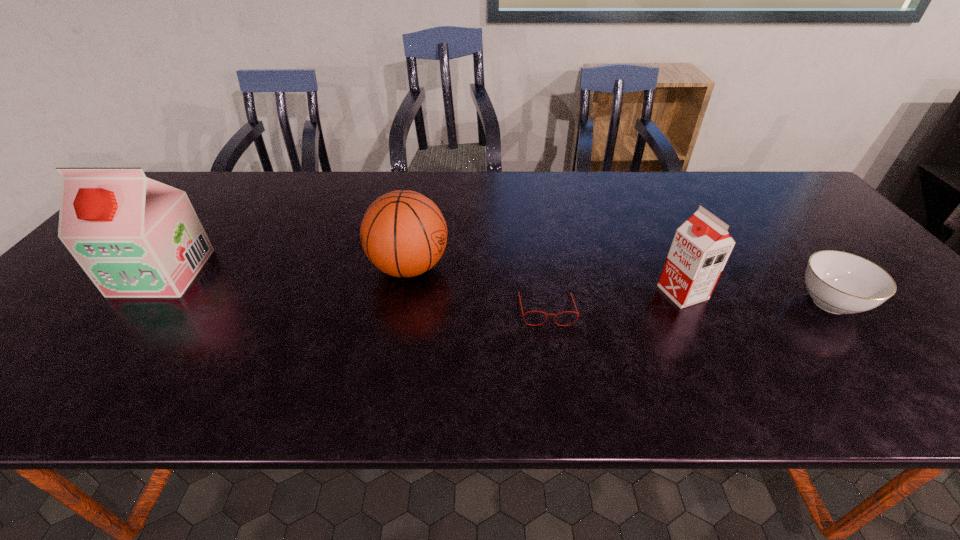
Find the location of `blank space at the far left corner of the desktop`. blank space at the far left corner of the desktop is located at coordinates (223, 174).

In the image, there is a desktop. Where is `vacant region at the near left corner`? The width and height of the screenshot is (960, 540). vacant region at the near left corner is located at coordinates (43, 380).

Locate an element on the screen. The width and height of the screenshot is (960, 540). free space between the spectacles and the second object from right to left is located at coordinates (614, 301).

Where is `free spot between the second object from left to right and the rightmost object`? This screenshot has width=960, height=540. free spot between the second object from left to right and the rightmost object is located at coordinates (619, 285).

Find the location of a particular element. Image resolution: width=960 pixels, height=540 pixels. free space between the fourth object from right to left and the rightmost object is located at coordinates (619, 285).

Where is `free space between the third object from right to left and the fourth tallest object`? The image size is (960, 540). free space between the third object from right to left and the fourth tallest object is located at coordinates (688, 306).

Where is `unoccupied position between the basketball and the shortest object`? The width and height of the screenshot is (960, 540). unoccupied position between the basketball and the shortest object is located at coordinates (477, 288).

The image size is (960, 540). Find the location of `vacant area between the right soya milk and the rightmost object`. vacant area between the right soya milk and the rightmost object is located at coordinates (756, 298).

Where is `unoccupied area between the chinaware and the fourth object from right to left`? unoccupied area between the chinaware and the fourth object from right to left is located at coordinates (619, 285).

Where is `free spot between the third object from right to left and the leftmost object`? free spot between the third object from right to left and the leftmost object is located at coordinates (x=354, y=291).